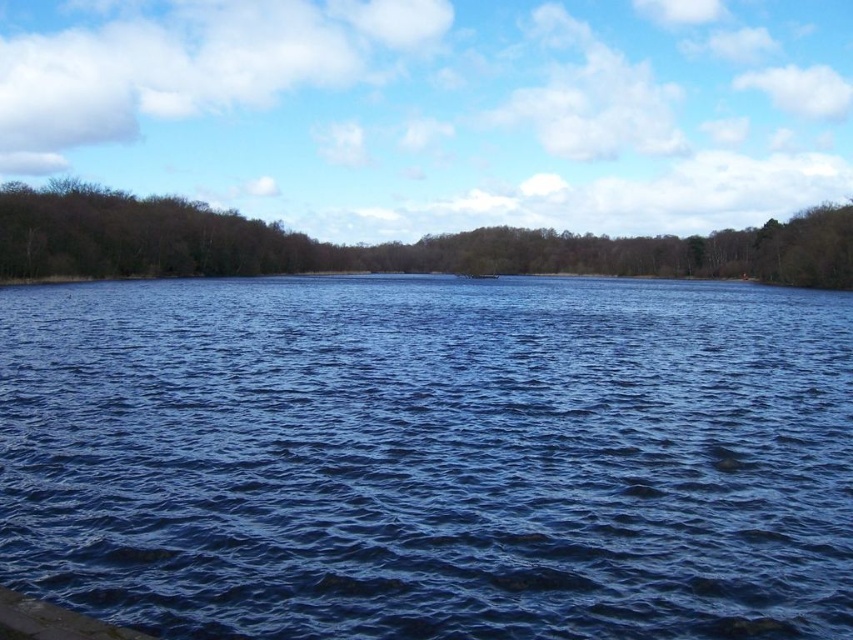
You are standing at the edge of the lake and want to know the exact position of the blue liquid water at center. According to the coordinates provided, where is it located?

The blue liquid water at center is located at point 0.716 in the x coordinate and 0.505 in the y coordinate.